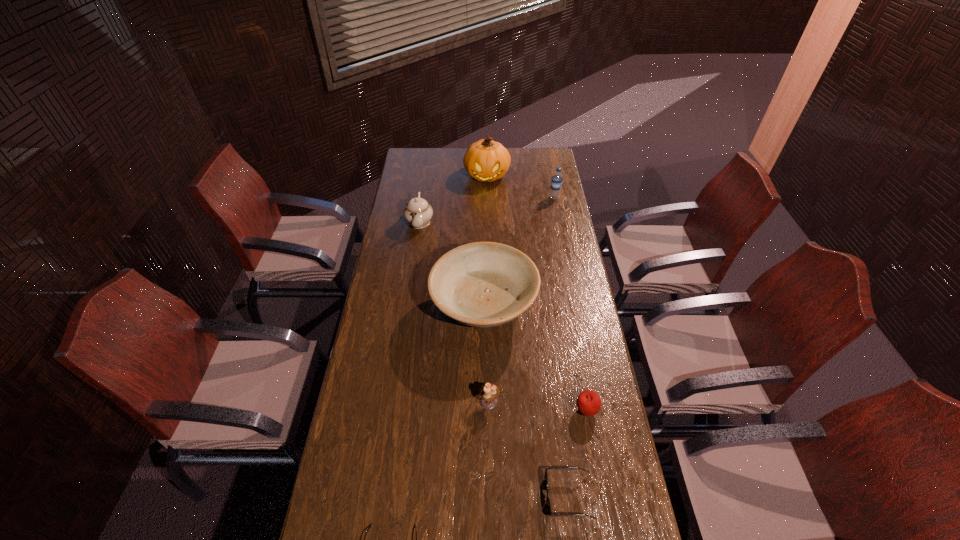
This screenshot has width=960, height=540. I want to click on object that is at the left edge, so click(418, 212).

Identify the location of water bottle located at the right edge. The image size is (960, 540). (556, 182).

Where is `apple that is at the right edge`? The height and width of the screenshot is (540, 960). apple that is at the right edge is located at coordinates (588, 402).

This screenshot has width=960, height=540. In order to click on sunglasses at the right edge in this screenshot , I will do `click(559, 468)`.

You are a GUI agent. You are given a task and a screenshot of the screen. Output one action in this format:
    pyautogui.click(x=<x>, y=<y>)
    Task: Click on the free spot at the far edge of the desktop
    This screenshot has width=960, height=540.
    Given the screenshot: What is the action you would take?
    pyautogui.click(x=459, y=156)

I want to click on vacant space at the left edge, so click(399, 215).

In the image, there is a desktop. At what (x,y) coordinates should I click in order to perform the action: click on free space at the right edge. Please return your answer as a coordinate pair (x, y). The width and height of the screenshot is (960, 540). Looking at the image, I should click on (587, 432).

Find the location of a particular element. This screenshot has height=540, width=960. vacant space that is in between the apple and the fifth nearest object is located at coordinates (535, 359).

Where is `empty space between the second farthest object and the seventh farthest object`? empty space between the second farthest object and the seventh farthest object is located at coordinates (562, 347).

Where is `free spot between the farthest object and the sunglasses`? Image resolution: width=960 pixels, height=540 pixels. free spot between the farthest object and the sunglasses is located at coordinates click(528, 336).